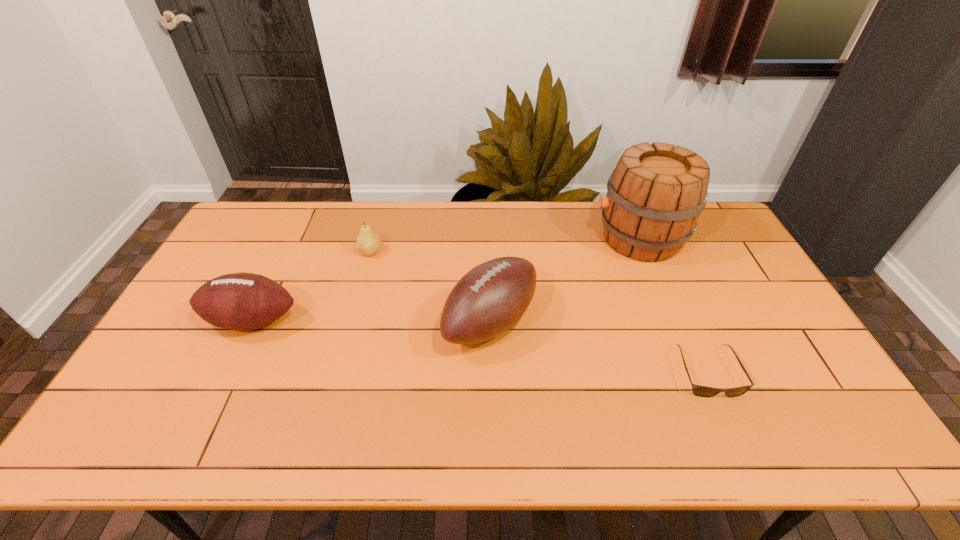
Identify the location of free space located 0.060m on the side of the tallest object where the spigot is located. Image resolution: width=960 pixels, height=540 pixels. (575, 238).

You are a GUI agent. You are given a task and a screenshot of the screen. Output one action in this format:
    pyautogui.click(x=<x>, y=<y>)
    Task: Click on the vacant space positioned on the front of the taller football (American)
    
    Given the screenshot: What is the action you would take?
    pyautogui.click(x=492, y=435)

You are a GUI agent. You are given a task and a screenshot of the screen. Output one action in this format:
    pyautogui.click(x=<x>, y=<y>)
    Task: Click on the vacant space located 0.160m on the front of the shorter football (American)
    The height and width of the screenshot is (540, 960).
    Given the screenshot: What is the action you would take?
    pyautogui.click(x=216, y=395)

Where is `free space located 0.090m on the right of the pear`? This screenshot has width=960, height=540. free space located 0.090m on the right of the pear is located at coordinates (409, 252).

Find the location of `vacant space located 0.080m on the lenses of the sunglasses`. vacant space located 0.080m on the lenses of the sunglasses is located at coordinates (732, 429).

The height and width of the screenshot is (540, 960). Find the location of `object that is at the far edge`. object that is at the far edge is located at coordinates (655, 195).

I want to click on object at the left edge, so click(x=242, y=301).

Find the location of a particular element. object that is positioned at the right edge is located at coordinates (655, 195).

You are a GUI agent. You are given a task and a screenshot of the screen. Output one action in this format:
    pyautogui.click(x=<x>, y=<y>)
    Task: Click on the object located at the far right corner
    The height and width of the screenshot is (540, 960).
    Given the screenshot: What is the action you would take?
    pyautogui.click(x=655, y=195)

In the image, there is a desktop. Where is `free space at the far edge`? The width and height of the screenshot is (960, 540). free space at the far edge is located at coordinates (509, 208).